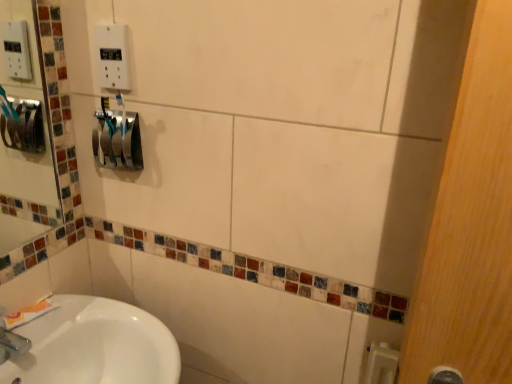
Question: Relative to blue glossy toothbrush at center-left, is white plastic outlet at upper center in front or behind?

Choices:
 (A) behind
 (B) front

Answer: (B)

Question: Is white plastic outlet at upper center situated inside blue glossy toothbrush at center-left or outside?

Choices:
 (A) outside
 (B) inside

Answer: (A)

Question: Estimate the real-world distances between objects in this image. Which object is closer to the blue glossy toothbrush at center-left?

Choices:
 (A) white plastic outlet at upper center
 (B) white matte toothpaste at lower left

Answer: (A)

Question: Estimate the real-world distances between objects in this image. Which object is closer to the white plastic outlet at upper center?

Choices:
 (A) blue glossy toothbrush at center-left
 (B) white matte toothpaste at lower left

Answer: (A)